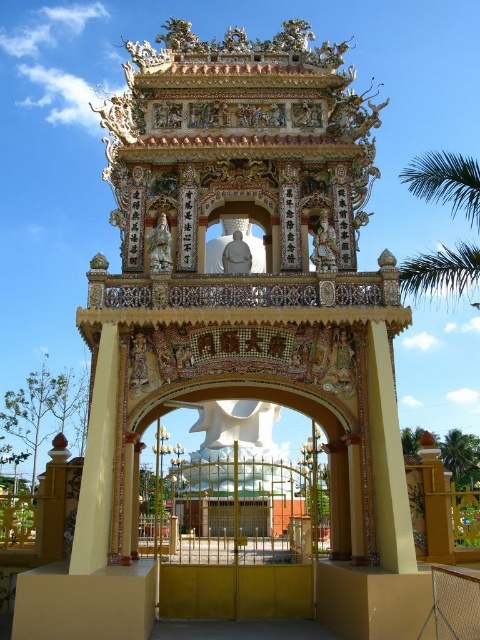
You are a visitor at the temple complex and want to take a photo of the central archway with both green leafy palm tree at upper right and green leafy palm tree at right in the background. Which palm tree will appear larger in the photo?

The green leafy palm tree at upper right will appear larger in the photo because it is bigger than the green leafy palm tree at right.

You are standing at the entrance of the temple complex and want to take a photo of the grand ornate gate. There is a green leafy palm tree at upper right in the background. Do you think the palm tree will be in the frame if you take the photo from where you are standing?

The green leafy palm tree at upper right is 66.65 meters away from the viewer. Since it is quite far, it might be too distant to be clearly visible in the photo unless using a telephoto lens. However, the exact visibility depends on the camera settings and lens used.

You are a visitor at the temple complex and want to take a photo of both green leafy palm tree at upper right and green leafy palm tree at right. Which palm tree should you zoom in more on to capture its full width in the photo?

The green leafy palm tree at upper right has a larger width than the green leafy palm tree at right, so you should zoom in more on the green leafy palm tree at upper right to capture its full width in the photo.